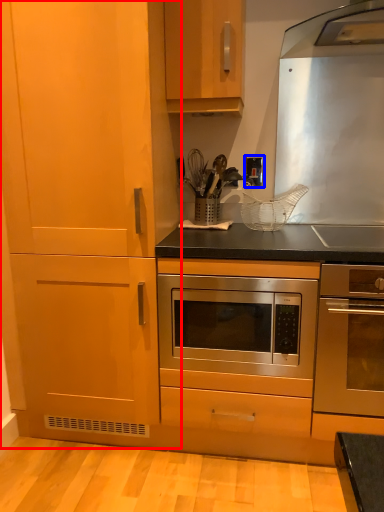
Question: Which of the following is the farthest to the observer, cabinetry (highlighted by a red box) or electric outlet (highlighted by a blue box)?

Choices:
 (A) cabinetry
 (B) electric outlet

Answer: (B)